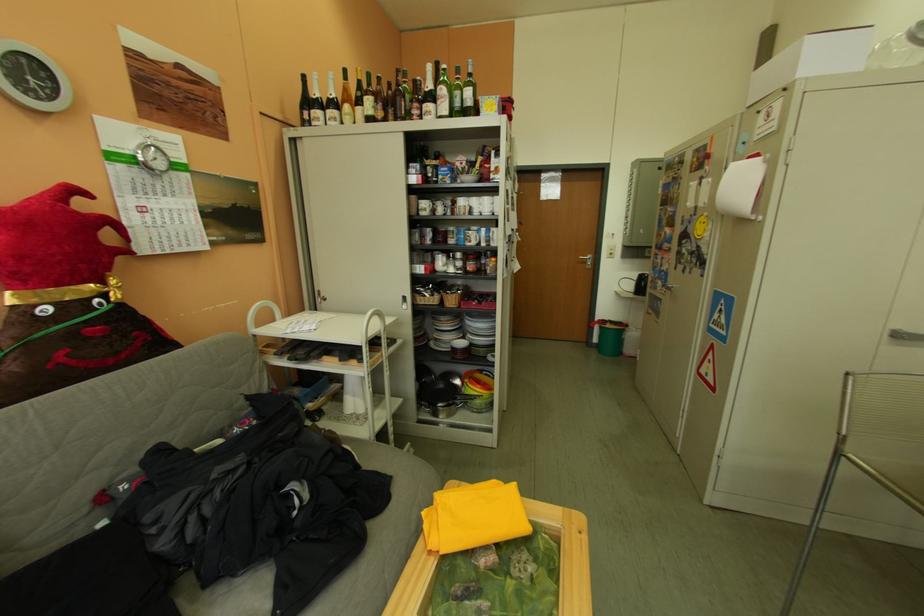
Find where to lift the stack of white plates. Please return your answer as a coordinate pair (x, y).

(464, 330)